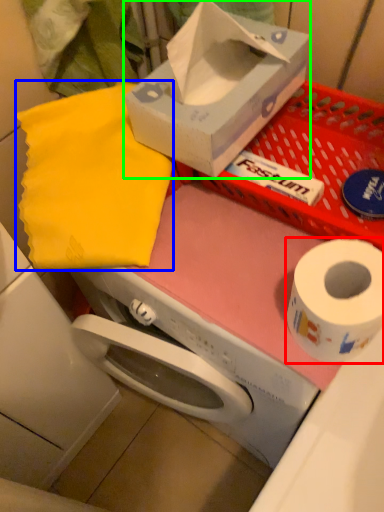
Question: Estimate the real-world distances between objects in this image. Which object is closer to toilet paper (highlighted by a red box), cloth (highlighted by a blue box) or box (highlighted by a green box)?

Choices:
 (A) cloth
 (B) box

Answer: (B)